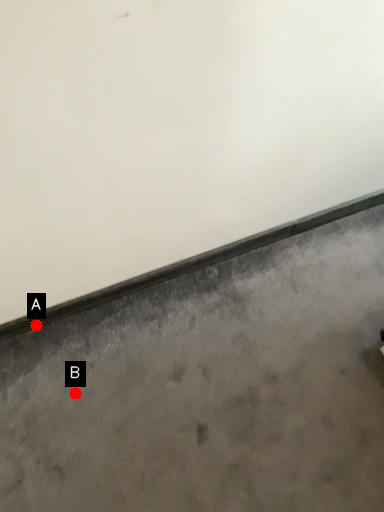
Question: Two points are circled on the image, labeled by A and B beside each circle. Which point appears farthest from the camera in this image?

Choices:
 (A) A is further
 (B) B is further

Answer: (A)